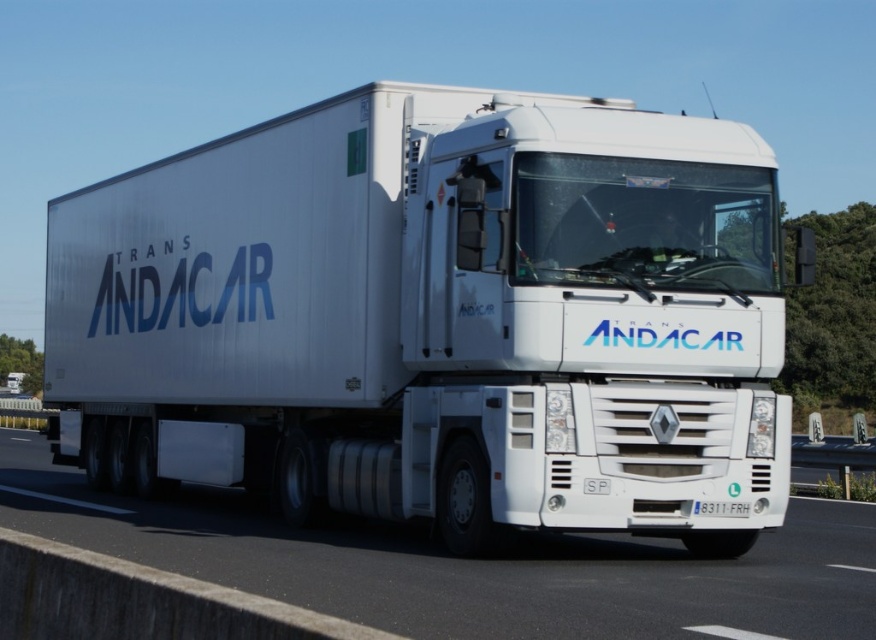
You are a traffic officer observing a white semi truck with a refrigerated trailer. The truck has two points marked on it, point A at coordinates point [576,564] and point B at coordinates point [733,506]. Which point is closer to you?

Point A at coordinates point [576,564] is closer to you than point B at coordinates point [733,506].